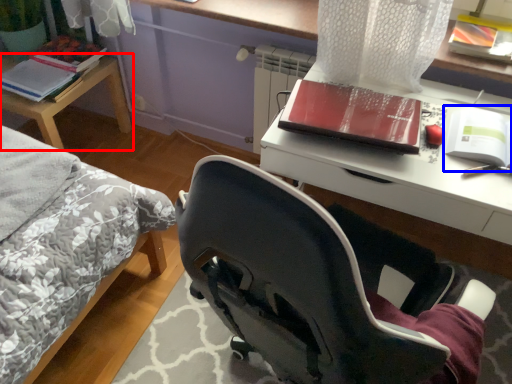
Question: Among these objects, which one is farthest to the camera, table (highlighted by a red box) or paperback book (highlighted by a blue box)?

Choices:
 (A) table
 (B) paperback book

Answer: (A)